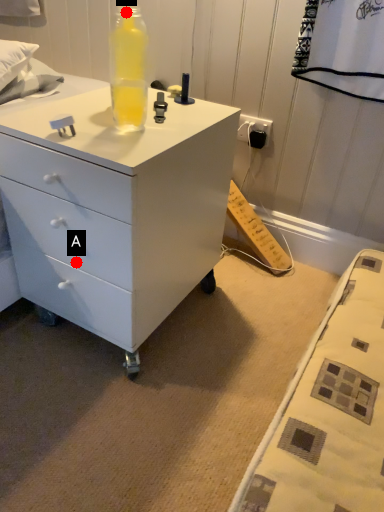
Question: Two points are circled on the image, labeled by A and B beside each circle. Which point appears closest to the camera in this image?

Choices:
 (A) A is closer
 (B) B is closer

Answer: (B)